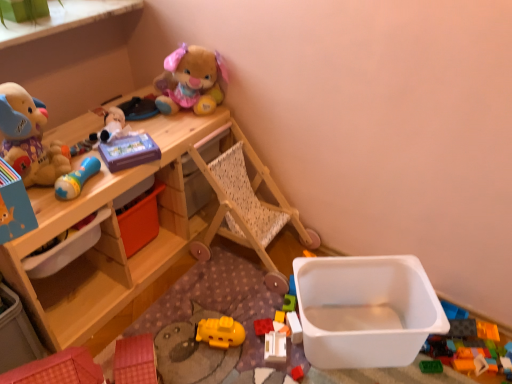
Locate an element on the screen. This screenshot has width=512, height=384. free space that is in between yellow plastic submarine at center, which ranks as the fourth toy in bottom-to-top order, and white plastic container at lower right, the 1th storage box ordered from the bottom is located at coordinates (258, 342).